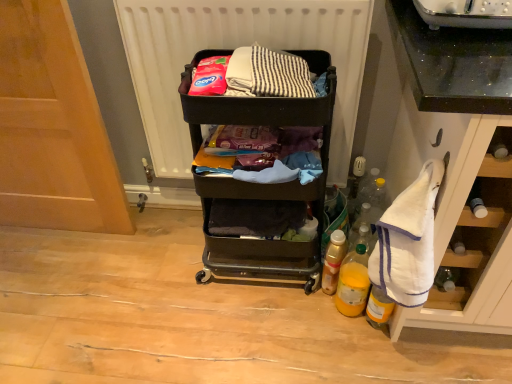
What is the approximate height of yellow matte bottle at lower right, arranged as the second bottle when viewed from the left?

It is 10.60 inches.

The width and height of the screenshot is (512, 384). Describe the element at coordinates (260, 184) in the screenshot. I see `black plastic cart at center` at that location.

This screenshot has height=384, width=512. Describe the element at coordinates (333, 261) in the screenshot. I see `translucent plastic bottle at lower right, the third bottle positioned from the right` at that location.

This screenshot has width=512, height=384. Describe the element at coordinates (378, 307) in the screenshot. I see `yellow translucent bottle at lower right, the first bottle viewed from the right` at that location.

Image resolution: width=512 pixels, height=384 pixels. Describe the element at coordinates (233, 48) in the screenshot. I see `white matte radiator at upper center` at that location.

I want to click on wooden at left, so click(53, 127).

Is wooden at left bigger or smaller than white terry cloth towel at right?

In the image, wooden at left appears to be larger than white terry cloth towel at right.

Considering the sizes of wooden at left and white terry cloth towel at right in the image, is wooden at left taller or shorter than white terry cloth towel at right?

wooden at left is taller than white terry cloth towel at right.

Is wooden at left inside the boundaries of white terry cloth towel at right, or outside?

wooden at left lies outside white terry cloth towel at right.

From the image's perspective, which is above, wooden at left or white terry cloth towel at right?

wooden at left is shown above in the image.

Locate an element on the screen. This screenshot has width=512, height=384. door lying on the left of translucent plastic bottle at lower right, the 1th bottle positioned from the left is located at coordinates tap(53, 127).

Would you say translucent plastic bottle at lower right, the 1th bottle positioned from the left, is outside wooden at left?

Yes, translucent plastic bottle at lower right, the 1th bottle positioned from the left, is located beyond the bounds of wooden at left.

Between point (329, 276) and point (106, 160), which one is positioned in front?

The point (329, 276) is in front.

Are translucent plastic bottle at lower right, the 1th bottle positioned from the left, and wooden at left located far from each other?

translucent plastic bottle at lower right, the 1th bottle positioned from the left, is far away from wooden at left.

Is there a large distance between black plastic cart at center and wooden at left?

No.

Visually, is black plastic cart at center positioned to the left or to the right of wooden at left?

black plastic cart at center is to the right of wooden at left.

From a real-world perspective, which is physically above, black plastic cart at center or wooden at left?

In real-world perspective, wooden at left is above.

Considering the relative positions of white terry cloth towel at right and wooden at left in the image provided, is white terry cloth towel at right to the right of wooden at left from the viewer's perspective?

Correct, you'll find white terry cloth towel at right to the right of wooden at left.

Does point (426, 257) appear closer or farther from the camera than point (3, 13)?

Point (426, 257) appears to be closer to the viewer than point (3, 13).

From a real-world perspective, is white terry cloth towel at right physically located above or below wooden at left?

white terry cloth towel at right is above wooden at left.

Find the location of a particular element. radiator that appears above the yellow matte bottle at lower right, arranged as the second bottle when viewed from the left (from the image's perspective) is located at coordinates (233, 48).

Is white matte radiator at upper center at the back of yellow matte bottle at lower right, arranged as the second bottle when viewed from the left?

That's not correct — yellow matte bottle at lower right, arranged as the second bottle when viewed from the left, is not looking away from white matte radiator at upper center.

What's the angular difference between yellow matte bottle at lower right, arranged as the second bottle when viewed from the right, and white matte radiator at upper center's facing directions?

They differ by 0.329 degrees in their facing directions.

From the image's perspective, is black plastic cart at center above translucent plastic bottle at lower right, the third bottle positioned from the right?

Yes.

Can you confirm if black plastic cart at center is thinner than translucent plastic bottle at lower right, the 1th bottle positioned from the left?

Incorrect, the width of black plastic cart at center is not less than that of translucent plastic bottle at lower right, the 1th bottle positioned from the left.

From a real-world perspective, between black plastic cart at center and translucent plastic bottle at lower right, the 1th bottle positioned from the left, who is vertically lower?

In real-world perspective, translucent plastic bottle at lower right, the 1th bottle positioned from the left, is lower.

At what (x,y) coordinates should I click in order to perform the action: click on the 1st bottle located beneath the wooden at left (from a real-world perspective). Please return your answer as a coordinate pair (x, y). Looking at the image, I should click on (353, 283).

How distant is wooden at left from yellow matte bottle at lower right, arranged as the second bottle when viewed from the left?

The distance of wooden at left from yellow matte bottle at lower right, arranged as the second bottle when viewed from the left, is 1.11 meters.

Is wooden at left inside the boundaries of yellow matte bottle at lower right, arranged as the second bottle when viewed from the left, or outside?

wooden at left exists outside the volume of yellow matte bottle at lower right, arranged as the second bottle when viewed from the left.

From a real-world perspective, who is located higher, wooden at left or yellow matte bottle at lower right, arranged as the second bottle when viewed from the left?

wooden at left, from a real-world perspective.

The height and width of the screenshot is (384, 512). I want to click on door that appears on the left of white terry cloth towel at right, so click(53, 127).

Identify the location of bottle that is the 1st one when counting rightward from the wooden at left. Image resolution: width=512 pixels, height=384 pixels. (333, 261).

Based on their spatial positions, is wooden at left or yellow translucent bottle at lower right, arranged as the 3th bottle when viewed from the left, closer to yellow matte bottle at lower right, arranged as the second bottle when viewed from the right?

yellow translucent bottle at lower right, arranged as the 3th bottle when viewed from the left, is closer to yellow matte bottle at lower right, arranged as the second bottle when viewed from the right.

Based on their spatial positions, is translucent plastic bottle at lower right, the 1th bottle positioned from the left, or yellow translucent bottle at lower right, arranged as the 3th bottle when viewed from the left, further from black plastic cart at center?

yellow translucent bottle at lower right, arranged as the 3th bottle when viewed from the left, lies further to black plastic cart at center than the other object.

Which object lies nearer to the anchor point black plastic cart at center, white terry cloth towel at right or white matte radiator at upper center?

The object closer to black plastic cart at center is white matte radiator at upper center.

Looking at the image, which one is located further to yellow translucent bottle at lower right, arranged as the 3th bottle when viewed from the left, yellow matte bottle at lower right, arranged as the second bottle when viewed from the right, or wooden at left?

The object further to yellow translucent bottle at lower right, arranged as the 3th bottle when viewed from the left, is wooden at left.

Based on their spatial positions, is translucent plastic bottle at lower right, the third bottle positioned from the right, or wooden at left further from white matte radiator at upper center?

translucent plastic bottle at lower right, the third bottle positioned from the right, is further to white matte radiator at upper center.

From the image, which object appears to be nearer to translucent plastic bottle at lower right, the 1th bottle positioned from the left, wooden at left or white terry cloth towel at right?

Among the two, white terry cloth towel at right is located nearer to translucent plastic bottle at lower right, the 1th bottle positioned from the left.

Based on their spatial positions, is translucent plastic bottle at lower right, the 1th bottle positioned from the left, or white matte radiator at upper center further from white terry cloth towel at right?

white matte radiator at upper center.

Based on their spatial positions, is white terry cloth towel at right or translucent plastic bottle at lower right, the third bottle positioned from the right, closer to yellow matte bottle at lower right, arranged as the second bottle when viewed from the right?

translucent plastic bottle at lower right, the third bottle positioned from the right, is positioned closer to the anchor yellow matte bottle at lower right, arranged as the second bottle when viewed from the right.

You are a GUI agent. You are given a task and a screenshot of the screen. Output one action in this format:
    pyautogui.click(x=<x>, y=<y>)
    Task: Click on the furniture between wooden at left and yellow matte bottle at lower right, arranged as the second bottle when viewed from the right, in the horizontal direction
    The width and height of the screenshot is (512, 384).
    Given the screenshot: What is the action you would take?
    pyautogui.click(x=260, y=184)

This screenshot has height=384, width=512. I want to click on radiator situated between wooden at left and white terry cloth towel at right from left to right, so click(233, 48).

The height and width of the screenshot is (384, 512). I want to click on bath towel between white matte radiator at upper center and translucent plastic bottle at lower right, the third bottle positioned from the right, from top to bottom, so click(x=408, y=240).

In order to click on furniture between white matte radiator at upper center and yellow matte bottle at lower right, arranged as the second bottle when viewed from the right, vertically in this screenshot , I will do `click(260, 184)`.